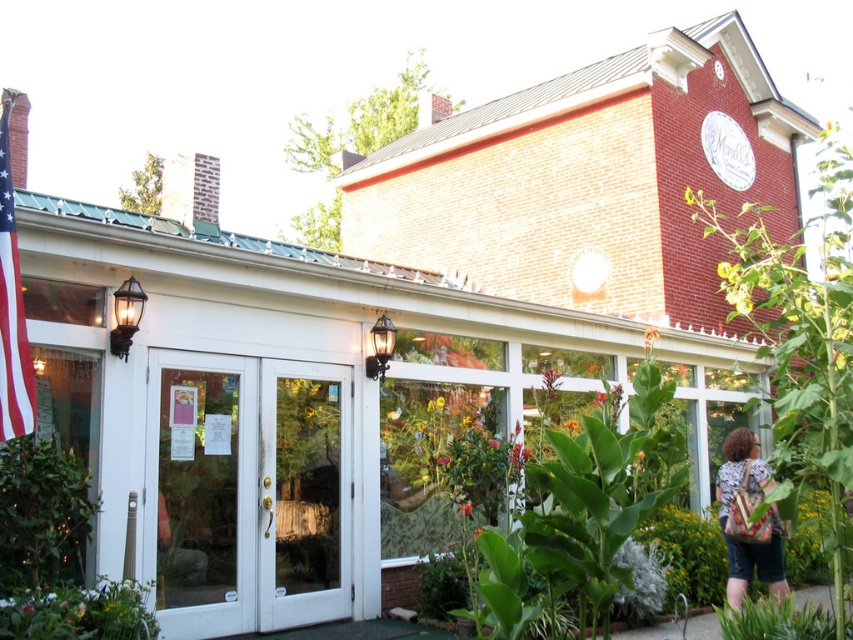
Where is `white glass door at center`? white glass door at center is located at coordinates (248, 492).

Does white glass door at center have a larger size compared to red fabric flag at left?

Yes, white glass door at center is bigger than red fabric flag at left.

This screenshot has width=853, height=640. I want to click on white glass door at center, so click(248, 492).

Between point (181, 372) and point (466, 509), which one is positioned behind?

Point (466, 509)

Describe the element at coordinates (248, 492) in the screenshot. This screenshot has height=640, width=853. I see `white glass door at center` at that location.

Is point (328, 609) closer to viewer compared to point (467, 502)?

Yes, point (328, 609) is closer to viewer.

Locate an element on the screen. The width and height of the screenshot is (853, 640). white glass door at center is located at coordinates (248, 492).

Who is positioned more to the right, red fabric flag at left or patterned fabric bag at right?

patterned fabric bag at right

What do you see at coordinates (10, 308) in the screenshot? This screenshot has width=853, height=640. I see `red fabric flag at left` at bounding box center [10, 308].

At what (x,y) coordinates should I click in order to perform the action: click on red fabric flag at left. Please return your answer as a coordinate pair (x, y). The width and height of the screenshot is (853, 640). Looking at the image, I should click on (10, 308).